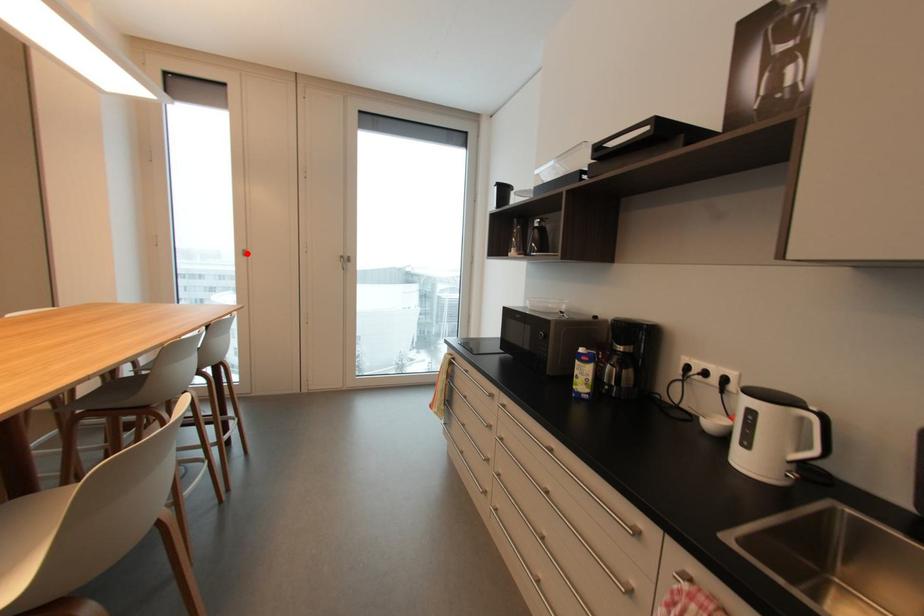
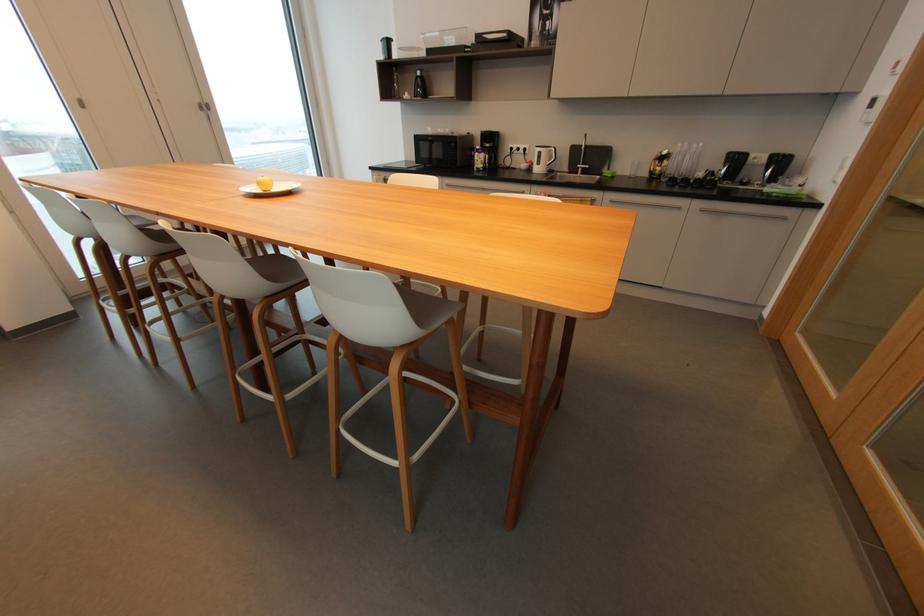
Locate, in the second image, the point that corresponds to the highlighted location in the first image.

(81, 103)